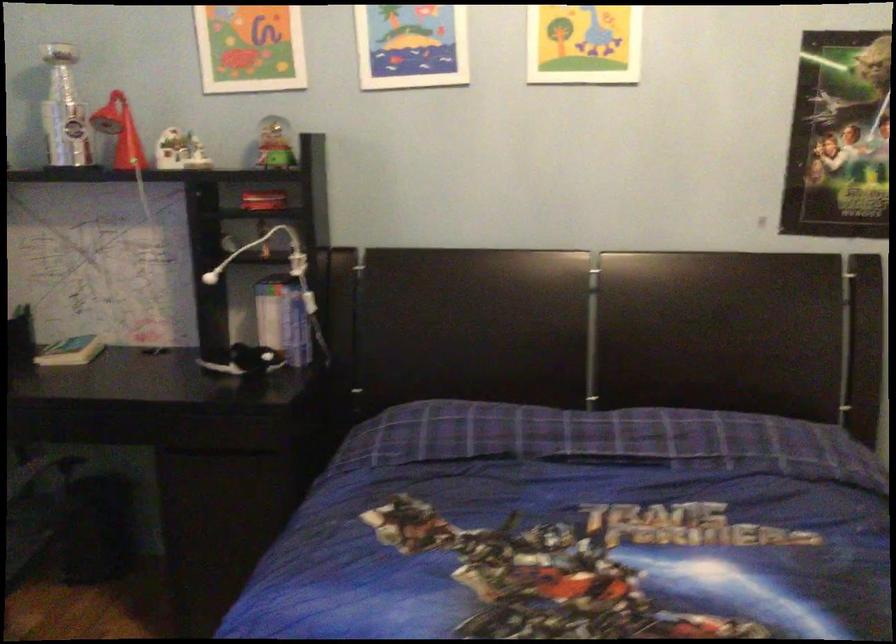
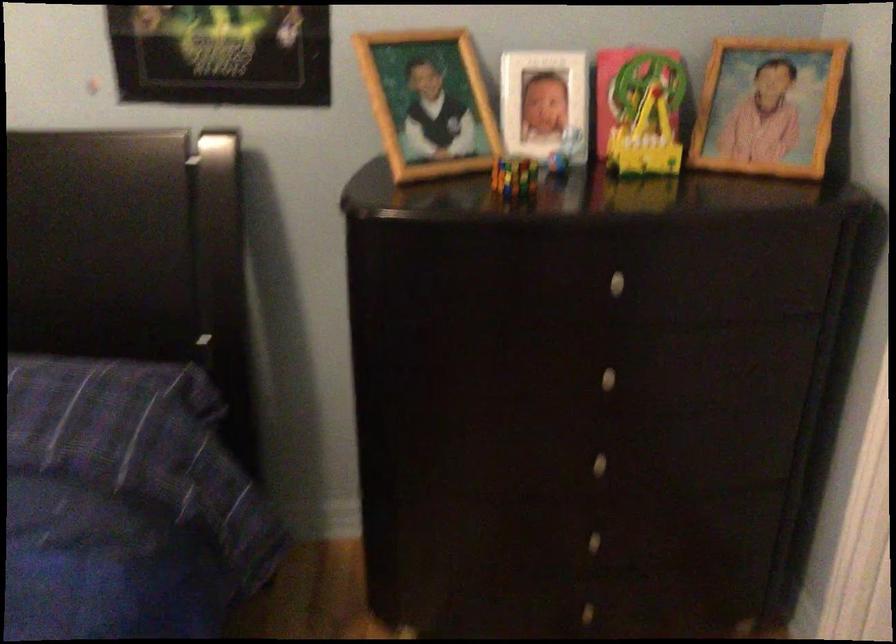
Question: Which direction would the cameraman need to move to produce the second image? Reply with the corresponding letter.

Choices:
 (A) Left
 (B) Right
 (C) Forward
 (D) Backward

Answer: (B)